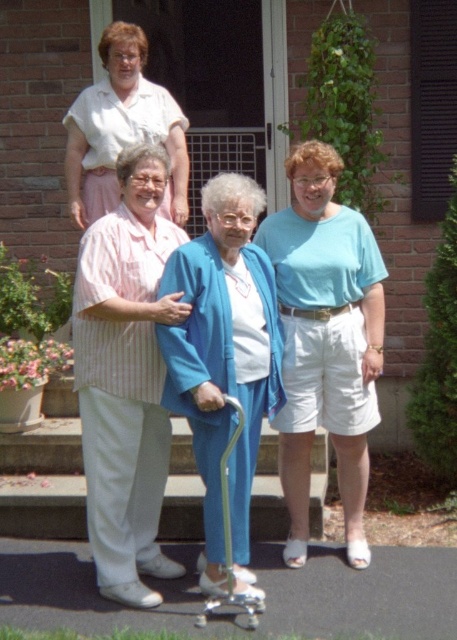
Does light blue cotton shirt at center appear under blue fabric cane at center?

Actually, light blue cotton shirt at center is above blue fabric cane at center.

Does point (299, 291) come behind point (210, 365)?

Yes, point (299, 291) is farther from viewer.

The height and width of the screenshot is (640, 457). Identify the location of light blue cotton shirt at center. (325, 340).

This screenshot has width=457, height=640. What do you see at coordinates (126, 378) in the screenshot? I see `white striped shirt at center` at bounding box center [126, 378].

Is white striped shirt at center to the left of light blue cotton shirt at center from the viewer's perspective?

Indeed, white striped shirt at center is positioned on the left side of light blue cotton shirt at center.

Image resolution: width=457 pixels, height=640 pixels. What do you see at coordinates (126, 378) in the screenshot?
I see `white striped shirt at center` at bounding box center [126, 378].

Where is `white striped shirt at center`? Image resolution: width=457 pixels, height=640 pixels. white striped shirt at center is located at coordinates (126, 378).

Who is higher up, light blue cotton shirt at center or pink fabric blouse at upper left?

pink fabric blouse at upper left

Between light blue cotton shirt at center and pink fabric blouse at upper left, which one is positioned lower?

light blue cotton shirt at center is below.

This screenshot has width=457, height=640. What do you see at coordinates (325, 340) in the screenshot?
I see `light blue cotton shirt at center` at bounding box center [325, 340].

You are a GUI agent. You are given a task and a screenshot of the screen. Output one action in this format:
    pyautogui.click(x=<x>, y=<y>)
    Task: Click on the light blue cotton shirt at center
    The width and height of the screenshot is (457, 640).
    Given the screenshot: What is the action you would take?
    pyautogui.click(x=325, y=340)